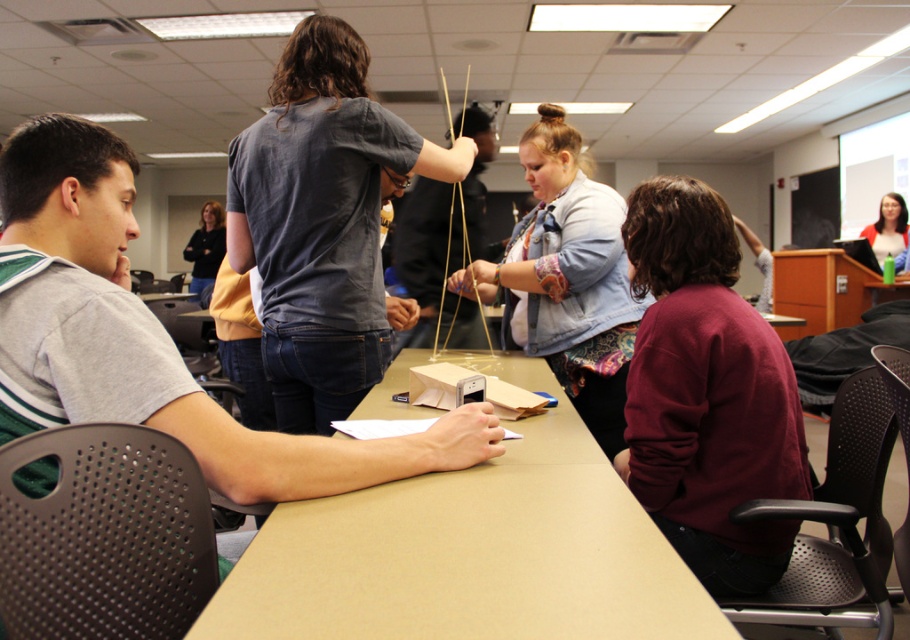
Who is higher up, maroon sweater at lower right or natural wood chopsticks at center?

natural wood chopsticks at center is above.

Does maroon sweater at lower right have a greater height compared to natural wood chopsticks at center?

Correct, maroon sweater at lower right is much taller as natural wood chopsticks at center.

Is point (804, 461) farther from camera compared to point (464, 99)?

No, (804, 461) is in front of (464, 99).

Find the location of a particular element. maroon sweater at lower right is located at coordinates (706, 394).

Based on the photo, is dark gray t-shirt at center to the left of matte black jacket at upper right from the viewer's perspective?

Correct, you'll find dark gray t-shirt at center to the left of matte black jacket at upper right.

Who is more forward, (366,68) or (892,196)?

Point (366,68) is in front.

You are a GUI agent. You are given a task and a screenshot of the screen. Output one action in this format:
    pyautogui.click(x=<x>, y=<y>)
    Task: Click on the dark gray t-shirt at center
    This screenshot has width=910, height=640.
    Given the screenshot: What is the action you would take?
    pyautogui.click(x=322, y=220)

Can you confirm if maroon sweater at lower right is bigger than dark gray t-shirt at center?

No.

Is maroon sweater at lower right further to the viewer compared to dark gray t-shirt at center?

No, it is not.

At what (x,y) coordinates should I click in order to perform the action: click on maroon sweater at lower right. Please return your answer as a coordinate pair (x, y). Looking at the image, I should click on tap(706, 394).

You are a GUI agent. You are given a task and a screenshot of the screen. Output one action in this format:
    pyautogui.click(x=<x>, y=<y>)
    Task: Click on the maroon sweater at lower right
    This screenshot has height=640, width=910.
    Given the screenshot: What is the action you would take?
    pyautogui.click(x=706, y=394)